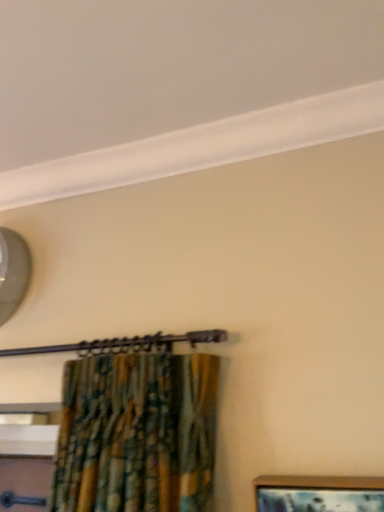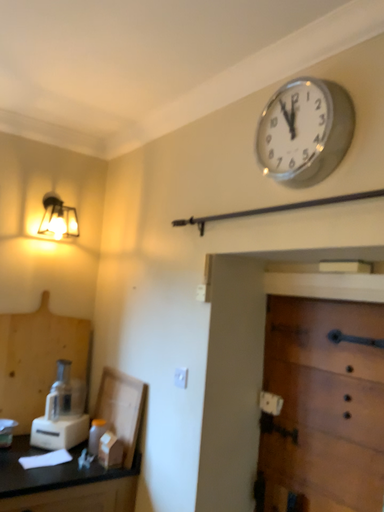
Question: How did the camera likely rotate when shooting the video?

Choices:
 (A) rotated downward
 (B) rotated upward

Answer: (A)